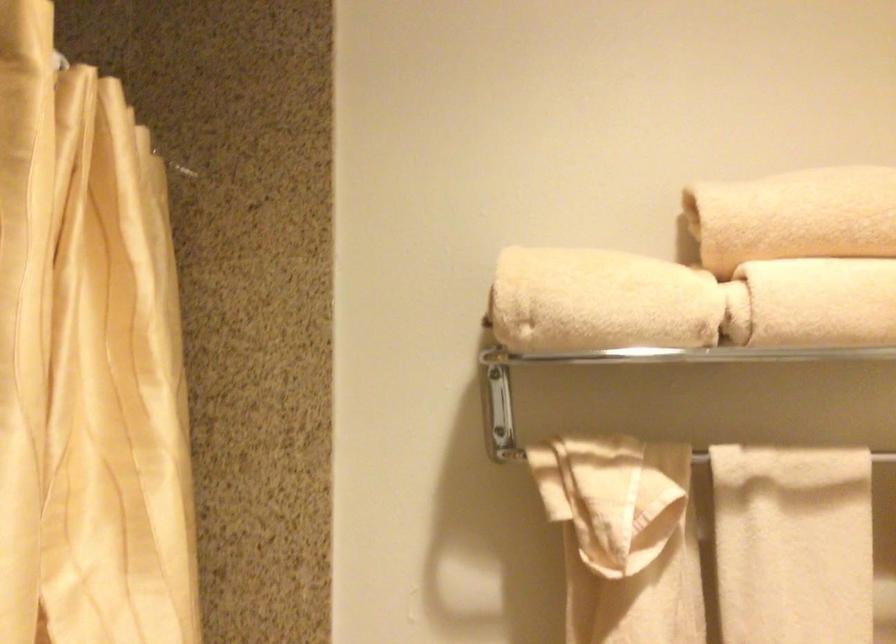
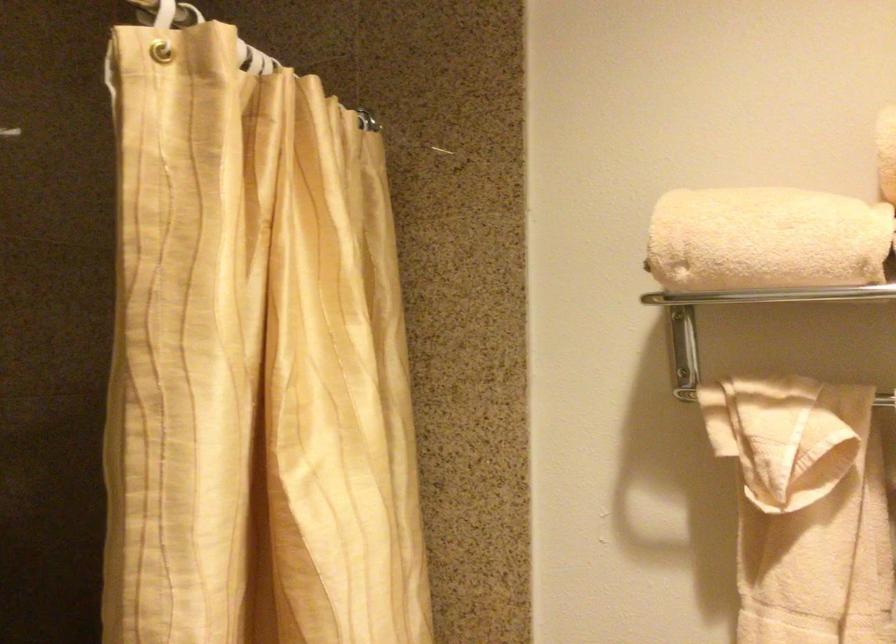
Question: The images are taken continuously from a first-person perspective. In which direction is your viewpoint rotating?

Choices:
 (A) Left
 (B) Right
 (C) Up
 (D) Down

Answer: (A)